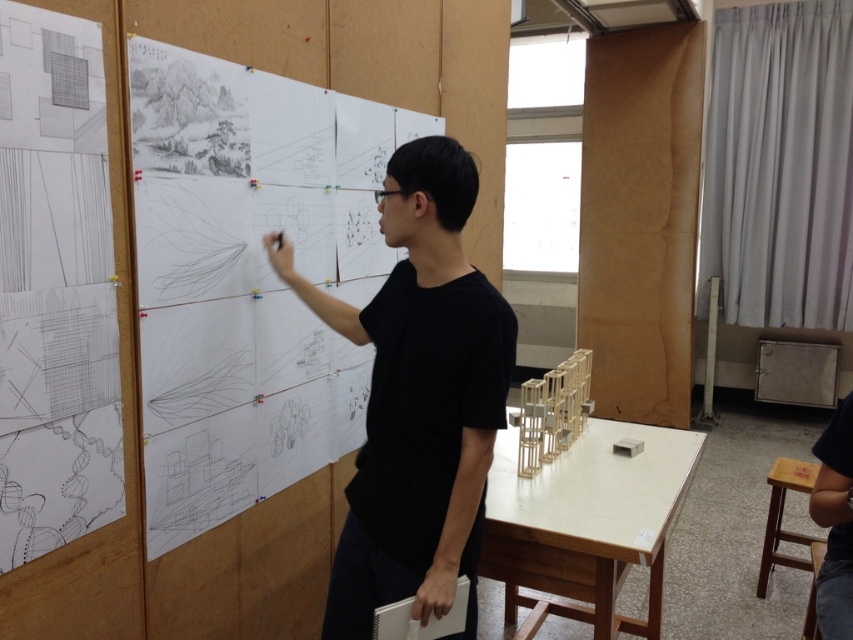
Does black matte shirt at center have a lesser width compared to wooden stool at lower right?

In fact, black matte shirt at center might be wider than wooden stool at lower right.

Is black matte shirt at center positioned before wooden stool at lower right?

Yes, it is.

The image size is (853, 640). In order to click on black matte shirt at center in this screenshot , I will do `click(418, 397)`.

Between black matte shirt at center and white matte table at center, which one is positioned lower?

white matte table at center is lower down.

Between point (395, 566) and point (608, 561), which one is positioned behind?

The point (608, 561) is more distant.

Find the location of a particular element. black matte shirt at center is located at coordinates (418, 397).

Is white matte table at center to the right of wooden stool at lower right from the viewer's perspective?

Incorrect, white matte table at center is not on the right side of wooden stool at lower right.

Does white matte table at center have a lesser width compared to wooden stool at lower right?

In fact, white matte table at center might be wider than wooden stool at lower right.

Find the location of a particular element. white matte table at center is located at coordinates pyautogui.click(x=585, y=524).

The image size is (853, 640). What are the coordinates of `white matte table at center` in the screenshot? It's located at (585, 524).